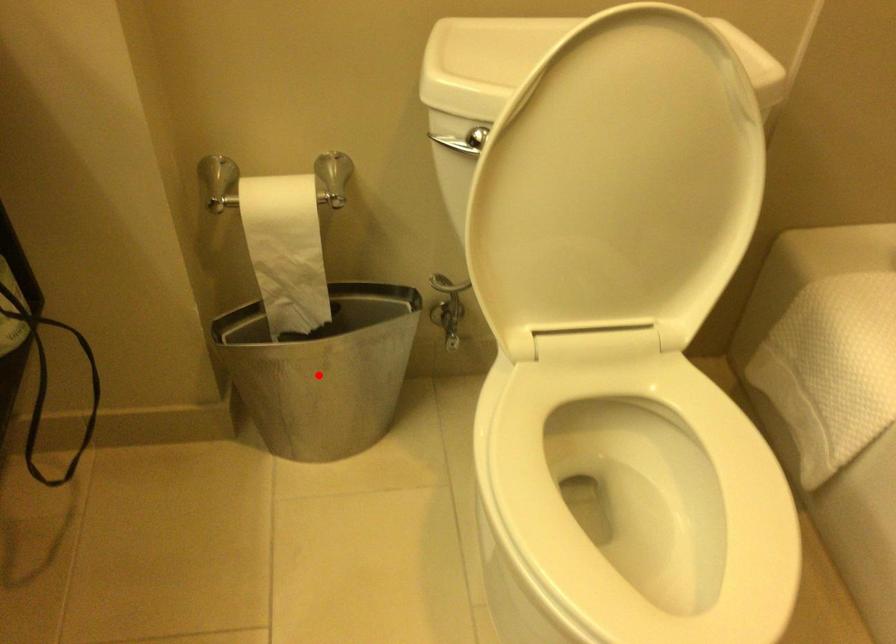
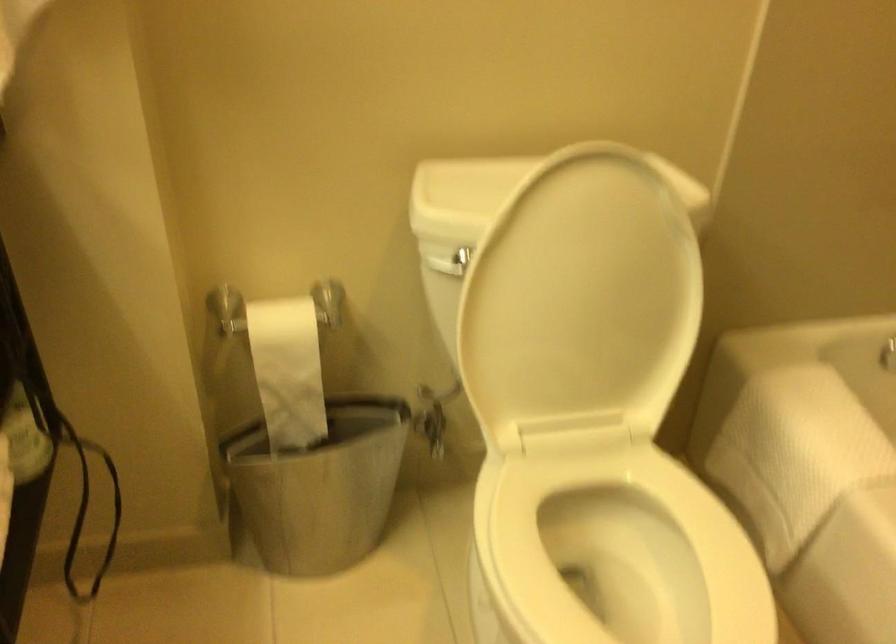
In the second image, find the point that corresponds to the highlighted location in the first image.

(319, 487)